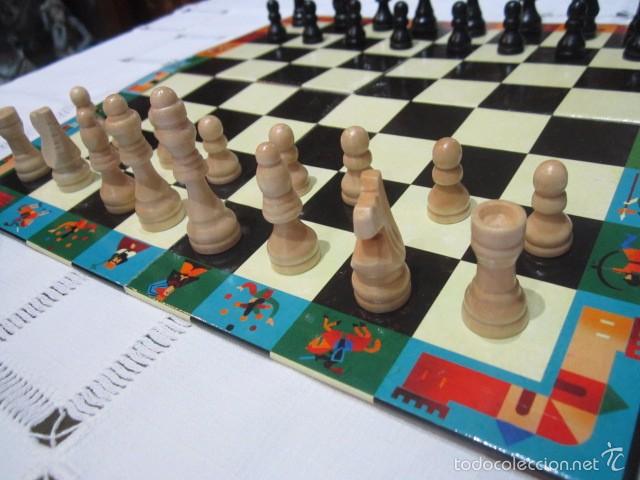
Locate an element on the screen. white tablecloth background is located at coordinates (x=225, y=406).